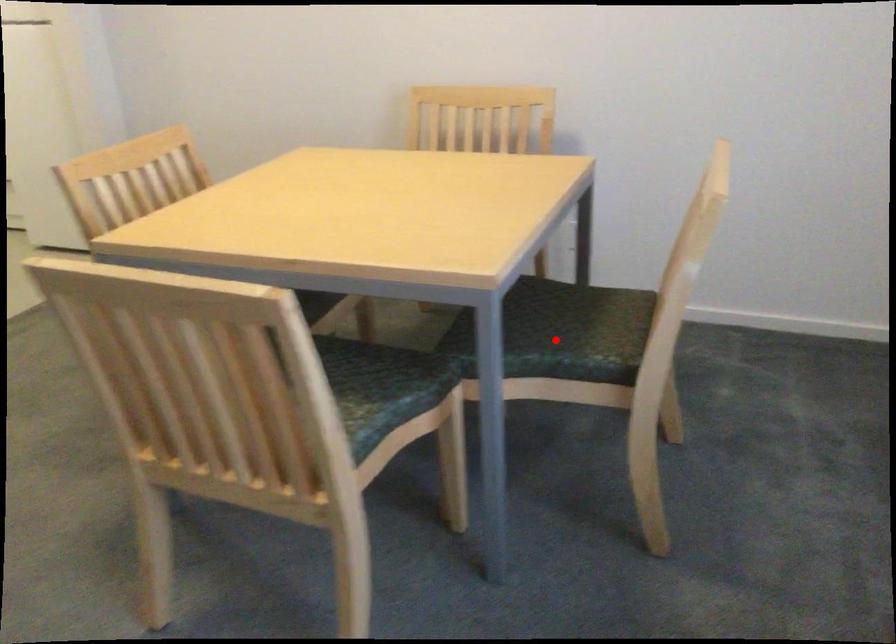
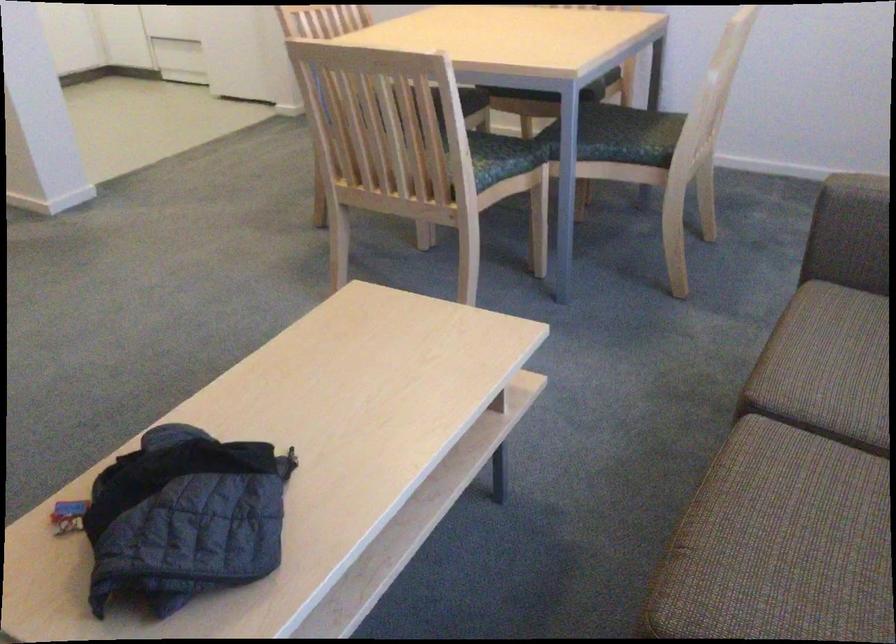
Question: I am providing you with two images of the same scene from different viewpoints. Image1 has a red point marked. In image2, the corresponding 3D location appears at what relative position? Reply with the corresponding letter.

Choices:
 (A) Closer
 (B) Farther

Answer: (B)